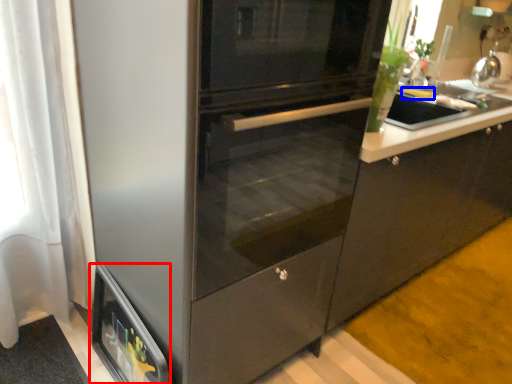
Question: Which point is further to the camera, home appliance (highlighted by a red box) or food (highlighted by a blue box)?

Choices:
 (A) home appliance
 (B) food

Answer: (B)